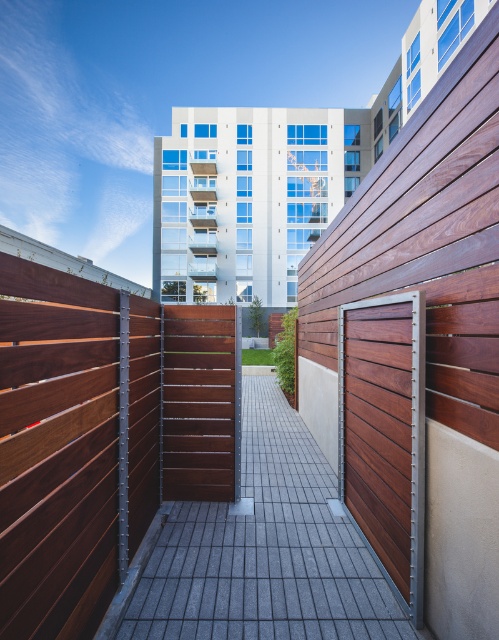
You are a delivery person standing at the entrance of the apartment building and need to place a package on the matte wood fence at center. According to the coordinates given, where exactly should you place the package?

The package should be placed at the coordinates point (100, 435) where the matte wood fence at center is located.

You are a delivery person approaching the entrance of the building. You need to place a package on the matte wood fence at center and ensure it doesn not fall onto the smooth gray stone path at center. What should you do?

The matte wood fence at center is located above the smooth gray stone path at center, so placing the package on the matte wood fence at center will prevent it from falling onto the smooth gray stone path at center as long as it stays on the elevated surface.

You are standing at the entrance of the apartment building and want to take a photo that includes both the point at coordinates (328, 627) and the point at (411, 419). Which point should you focus on first to ensure both are in sharp focus?

You should focus on the point at (411, 419) first because it is farther from the camera than the point at (328, 627). By focusing on the farther point, the closer point will also be within the depth of field, ensuring both are in sharp focus.